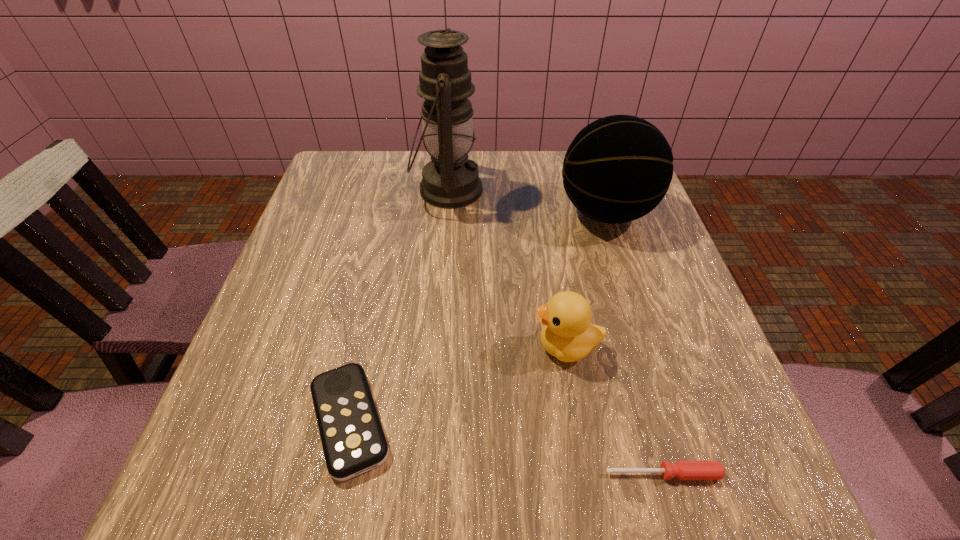
Identify the location of free space that satisfies the following two spatial constraints: 1. on the face of the third nearest object; 2. on the right side of the screwdriver. [x=588, y=474].

I want to click on vacant region that satisfies the following two spatial constraints: 1. on the face of the shortest object; 2. on the right side of the third nearest object, so click(x=588, y=474).